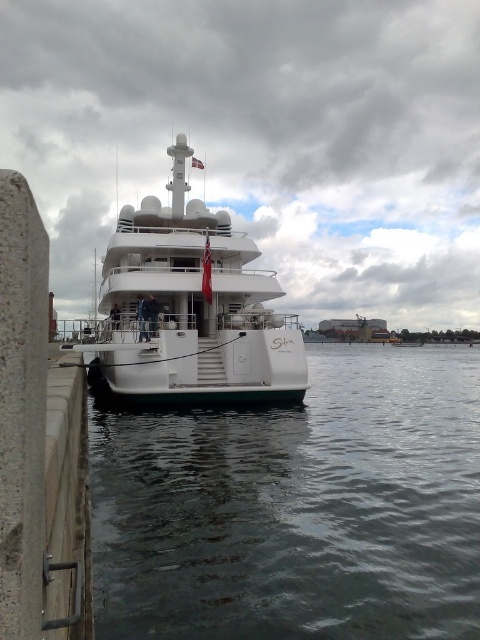
Which is behind, point (408, 403) or point (194, 358)?

The point (408, 403) is more distant.

Between clear water at lower center and white glossy yacht at center, which one has less height?

clear water at lower center is shorter.

Which is in front, point (365, 582) or point (247, 321)?

Point (365, 582) is in front.

I want to click on clear water at lower center, so click(298, 508).